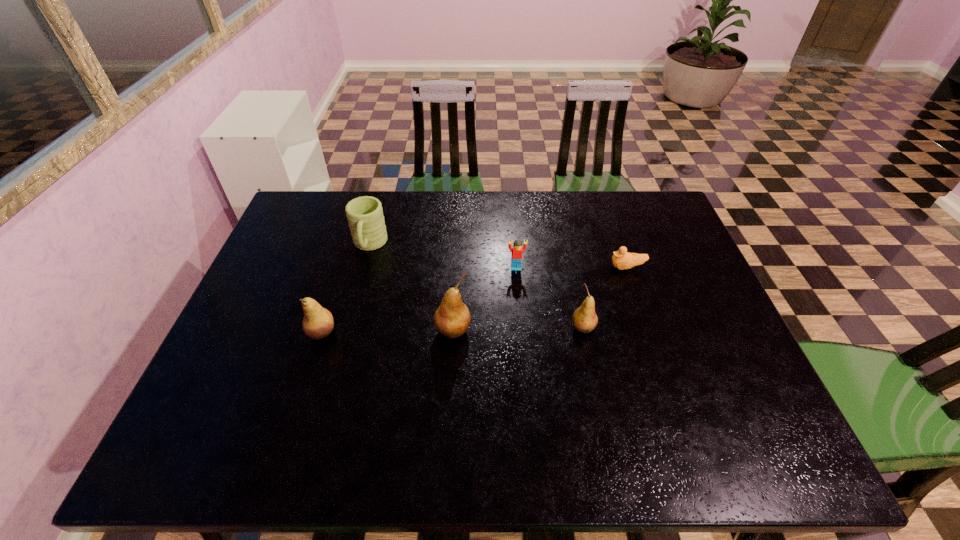
The height and width of the screenshot is (540, 960). Identify the location of vacant area between the second pear from left to right and the second object from right to left. (518, 329).

At what (x,y) coordinates should I click in order to perform the action: click on unoccupied position between the third object from right to left and the leftmost pear. Please return your answer as a coordinate pair (x, y). Looking at the image, I should click on (419, 300).

This screenshot has height=540, width=960. Identify the location of vacant area between the shortest object and the second pear from right to left. (540, 299).

In order to click on empty location between the fourth object from right to left and the third object from right to left in this screenshot , I will do `click(485, 299)`.

The height and width of the screenshot is (540, 960). I want to click on vacant area that lies between the shortest object and the second object from right to left, so click(x=605, y=298).

Find the location of a particular element. This screenshot has height=540, width=960. vacant space that's between the second pear from right to left and the mug is located at coordinates (411, 288).

Select which object is the fourth closest to the duckling. Please provide its 2D coordinates. Your answer should be formatted as a tuple, i.e. [(x, y)], where the tuple contains the x and y coordinates of a point satisfying the conditions above.

[(365, 216)]

Locate an element on the screen. the second closest object relative to the rightmost pear is located at coordinates (517, 249).

Identify the location of pear that is the closest to the mug. This screenshot has height=540, width=960. (318, 322).

The image size is (960, 540). I want to click on pear that is the second nearest to the mug, so click(x=452, y=319).